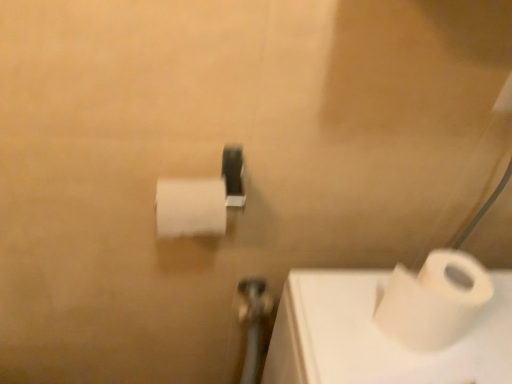
Question: Is white matte toilet paper at center, which is the 1th toilet paper from top to bottom, not near metallic silver shower at center?

Choices:
 (A) yes
 (B) no

Answer: (B)

Question: Is white matte toilet paper at center, the 1th toilet paper in the left-to-right sequence, surrounding metallic silver shower at center?

Choices:
 (A) yes
 (B) no

Answer: (B)

Question: Is white matte toilet paper at center, the 1th toilet paper in the left-to-right sequence, thinner than metallic silver shower at center?

Choices:
 (A) no
 (B) yes

Answer: (B)

Question: Does white matte toilet paper at center, positioned as the 2th toilet paper in right-to-left order, have a lesser height compared to metallic silver shower at center?

Choices:
 (A) yes
 (B) no

Answer: (A)

Question: Is white matte toilet paper at center, the 1th toilet paper in the left-to-right sequence, bigger than metallic silver shower at center?

Choices:
 (A) yes
 (B) no

Answer: (A)

Question: Is white matte toilet paper at lower right, marked as the second toilet paper in a left-to-right arrangement, inside or outside of metallic silver shower at center?

Choices:
 (A) outside
 (B) inside

Answer: (A)

Question: Is white matte toilet paper at lower right, marked as the second toilet paper in a left-to-right arrangement, wider or thinner than metallic silver shower at center?

Choices:
 (A) wide
 (B) thin

Answer: (A)

Question: Considering the positions of point (425, 269) and point (262, 283), is point (425, 269) closer or farther from the camera than point (262, 283)?

Choices:
 (A) closer
 (B) farther

Answer: (A)

Question: Visually, is white matte toilet paper at lower right, acting as the second toilet paper starting from the top, positioned to the left or to the right of metallic silver shower at center?

Choices:
 (A) left
 (B) right

Answer: (B)

Question: From the image's perspective, relative to metallic silver shower at center, is white matte toilet paper at center, which is the 1th toilet paper from top to bottom, above or below?

Choices:
 (A) below
 (B) above

Answer: (B)

Question: From a real-world perspective, relative to metallic silver shower at center, is white matte toilet paper at center, positioned as the 2th toilet paper in right-to-left order, vertically above or below?

Choices:
 (A) above
 (B) below

Answer: (A)

Question: Is white matte toilet paper at center, the 1th toilet paper in the left-to-right sequence, inside or outside of metallic silver shower at center?

Choices:
 (A) outside
 (B) inside

Answer: (A)

Question: Considering the relative positions of white matte toilet paper at center, which is the 1th toilet paper from top to bottom, and metallic silver shower at center in the image provided, is white matte toilet paper at center, which is the 1th toilet paper from top to bottom, to the left or to the right of metallic silver shower at center?

Choices:
 (A) left
 (B) right

Answer: (A)

Question: Looking at their shapes, would you say white matte toilet paper at lower right, the 1th toilet paper from the bottom, is wider or thinner than white matte toilet paper at center, positioned as the 2th toilet paper in bottom-to-top order?

Choices:
 (A) wide
 (B) thin

Answer: (A)

Question: Considering the relative positions of white matte toilet paper at lower right, the 1th toilet paper from the bottom, and white matte toilet paper at center, which is the 1th toilet paper from top to bottom, in the image provided, is white matte toilet paper at lower right, the 1th toilet paper from the bottom, to the left or to the right of white matte toilet paper at center, which is the 1th toilet paper from top to bottom,?

Choices:
 (A) left
 (B) right

Answer: (B)